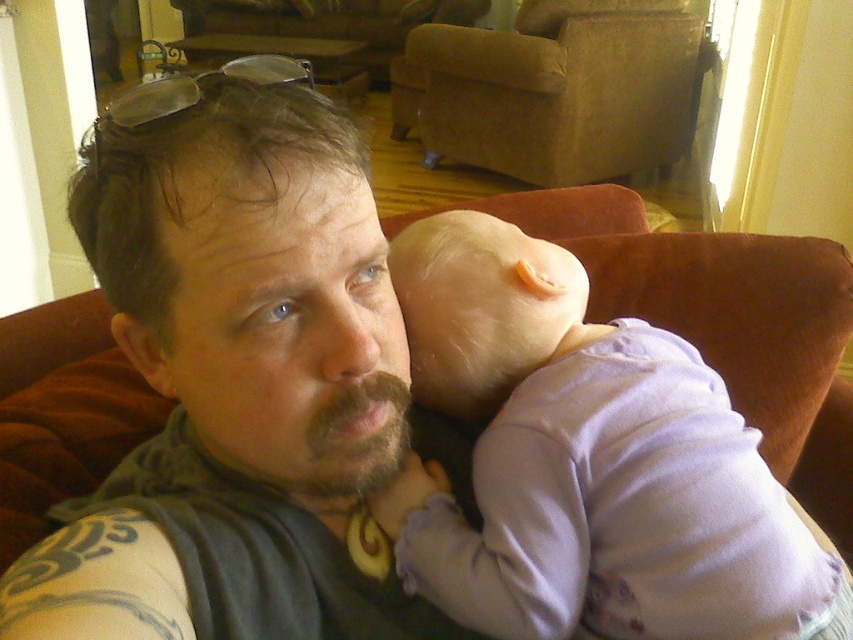
What are the coordinates of `dark gray vest at center` in the screenshot? It's located at (254, 352).

Between point (128, 301) and point (498, 509), which one is positioned in front?

Positioned in front is point (128, 301).

Which is behind, point (213, 486) or point (500, 506)?

The point (500, 506) is behind.

I want to click on dark gray vest at center, so click(x=254, y=352).

Is point (466, 305) behind point (672, 116)?

No.

The width and height of the screenshot is (853, 640). Describe the element at coordinates (587, 460) in the screenshot. I see `purple soft fabric at center` at that location.

The width and height of the screenshot is (853, 640). Find the location of `purple soft fabric at center`. purple soft fabric at center is located at coordinates (587, 460).

Does dark gray vest at center have a lesser height compared to brown suede armchair at upper center?

Indeed, dark gray vest at center has a lesser height compared to brown suede armchair at upper center.

Consider the image. Does dark gray vest at center have a greater width compared to brown suede armchair at upper center?

No, dark gray vest at center is not wider than brown suede armchair at upper center.

What do you see at coordinates (254, 352) in the screenshot?
I see `dark gray vest at center` at bounding box center [254, 352].

At what (x,y) coordinates should I click in order to perform the action: click on dark gray vest at center. Please return your answer as a coordinate pair (x, y). The image size is (853, 640). Looking at the image, I should click on pyautogui.click(x=254, y=352).